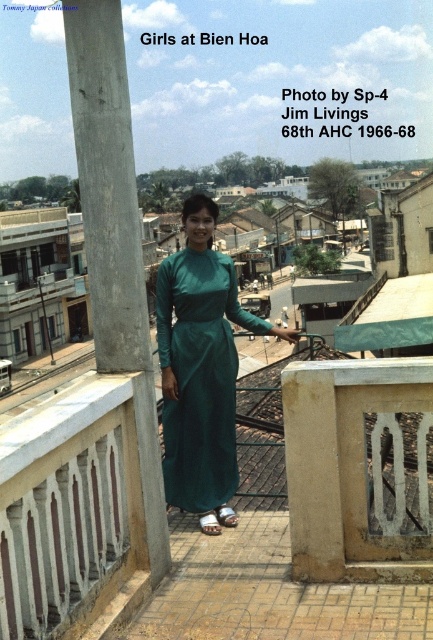
In the scene from Bien Hoa, Vietnam, there is a white concrete porch at center and a concrete at center. Which of these two structures is narrower in width?

The white concrete porch at center has a lesser width compared to the concrete at center, so it is narrower.